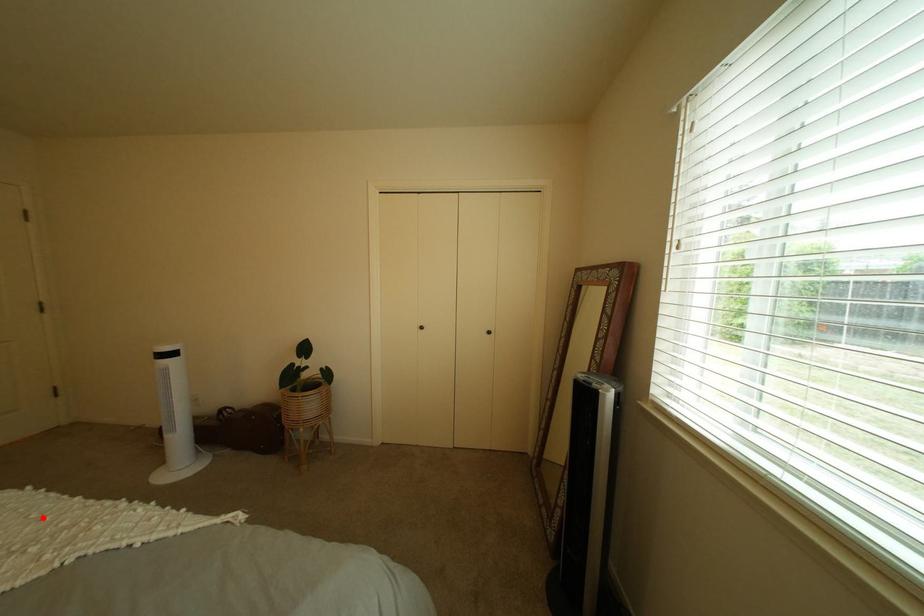
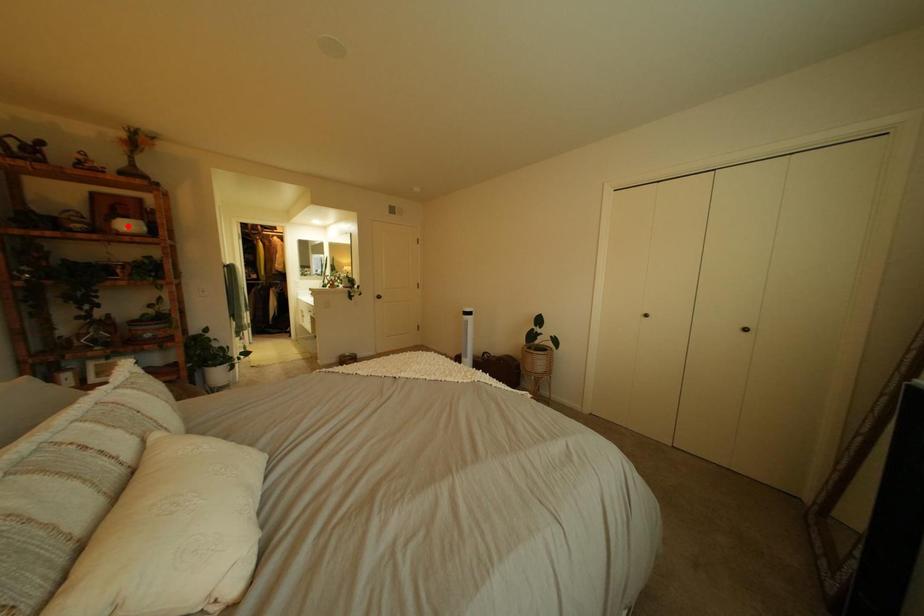
I am providing you with two images of the same scene from different viewpoints. A red point is marked on the first image and another point is marked on the second image. Is the marked point in image1 the same physical position as the marked point in image2?

No